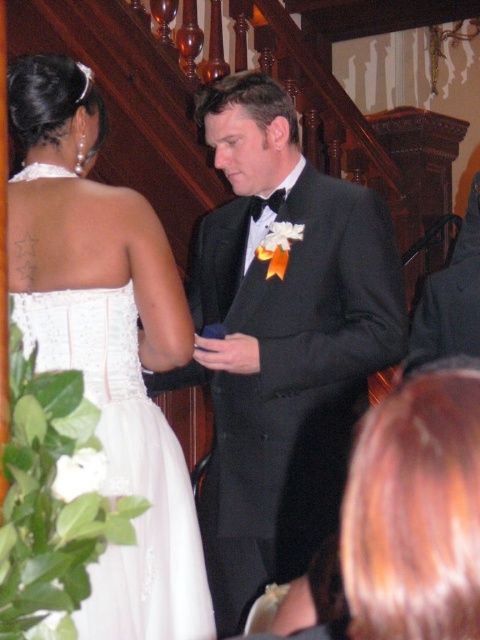
Who is taller, black satin tuxedo at center or white lace dress at upper left?

With more height is black satin tuxedo at center.

Which is in front, point (280, 557) or point (84, 625)?

Point (84, 625)

The height and width of the screenshot is (640, 480). In order to click on black satin tuxedo at center in this screenshot , I will do `click(282, 340)`.